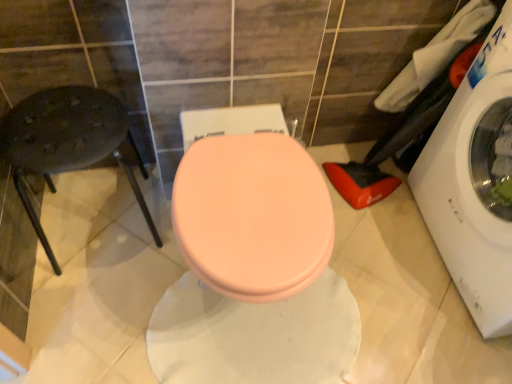
Where is `empty space that is ontop of metallic black stool at left`? empty space that is ontop of metallic black stool at left is located at coordinates (62, 128).